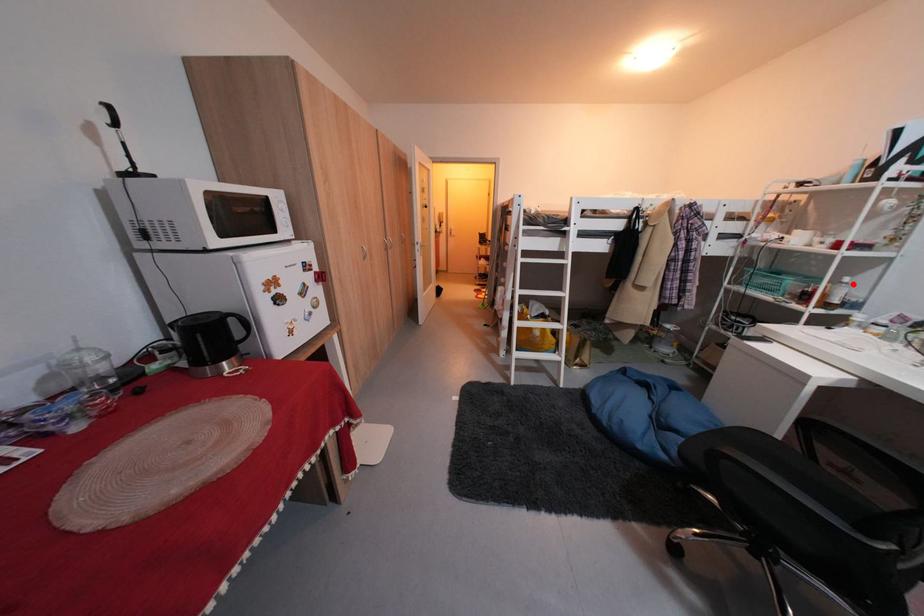
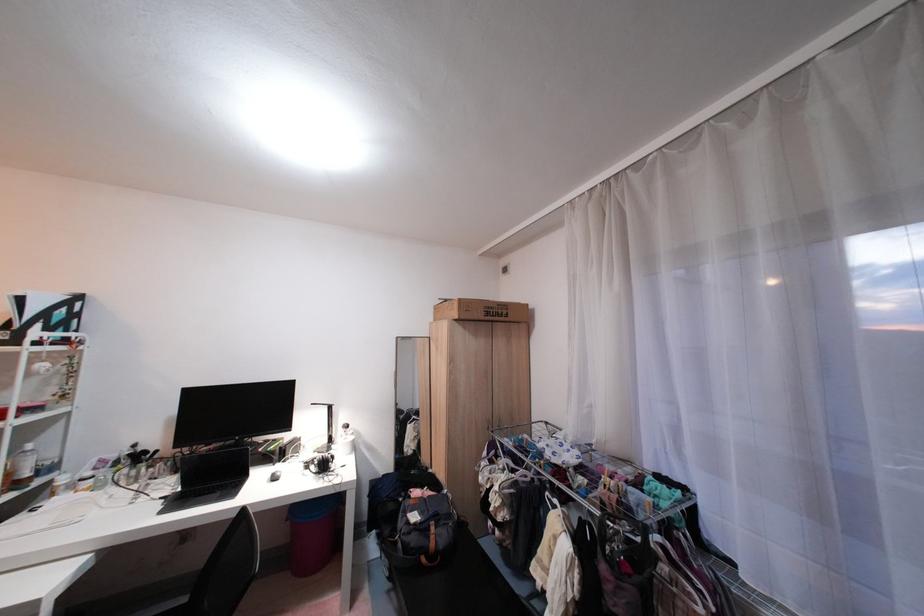
Question: I am providing you with two images of the same scene from different viewpoints. In image1, a red point is highlighted. Considering the same 3D point in image2, which of the following is correct?

Choices:
 (A) It is closer
 (B) It is farther

Answer: (A)